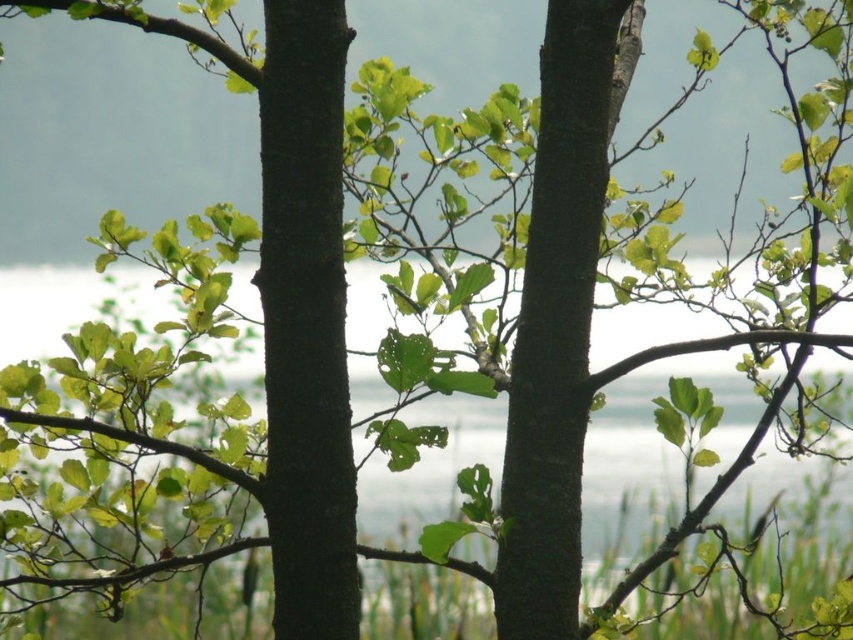
Looking at this image, who is higher up, dark brown rough tree trunk at center or smooth bark tree trunk at center?

smooth bark tree trunk at center is above.

Consider the image. Is dark brown rough tree trunk at center further to the viewer compared to smooth bark tree trunk at center?

No, it is in front of smooth bark tree trunk at center.

Between point (316, 140) and point (611, 67), which one is positioned in front?

Point (316, 140) is more forward.

At what (x,y) coordinates should I click in order to perform the action: click on dark brown rough tree trunk at center. Please return your answer as a coordinate pair (x, y). This screenshot has height=640, width=853. Looking at the image, I should click on (306, 323).